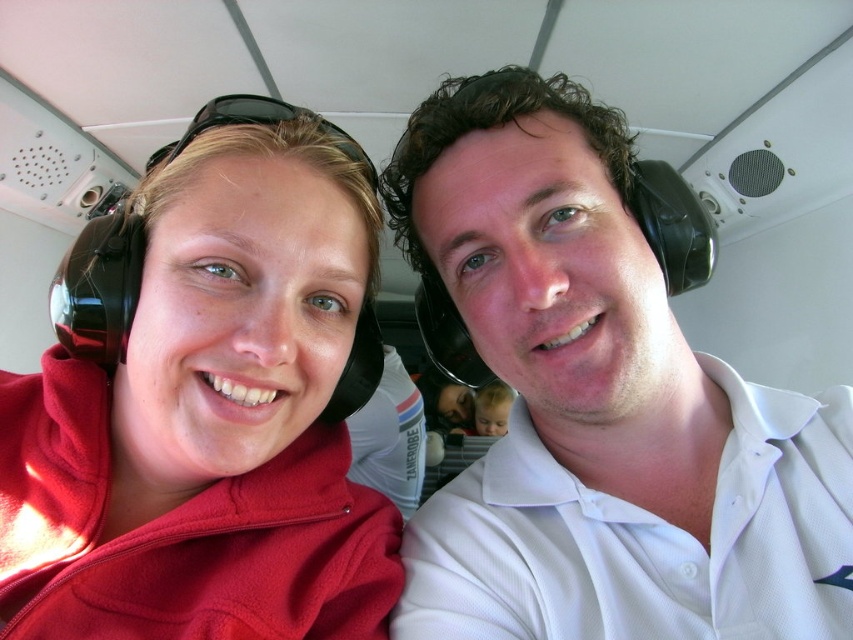
You are a flight attendant on this aircraft. You need to place a 30 cm tall toy on the seat between the matte fleece jacket at left and the smooth skin baby at center. Can you fit the toy there without overlapping either of them?

The matte fleece jacket at left is much taller than the smooth skin baby at center. Since the toy is 30 cm tall, it can be placed between them as long as there is enough vertical space between the two objects. However, the exact placement depends on their horizontal positioning, which isn

You are a flight attendant on a small aircraft. You need to locate the matte fleece jacket at left and the smooth skin baby at center for a safety check. Based on their positions, which object is closer to the left side of the cabin?

The matte fleece jacket at left is closer to the left side of the cabin since it is positioned to the left of the smooth skin baby at center.